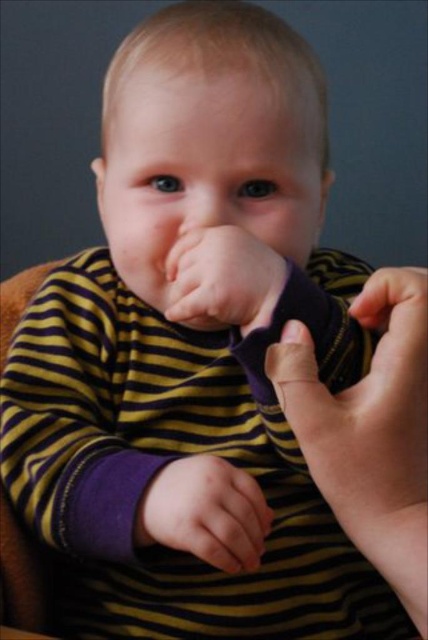
You are a babysitter looking after a baby in a striped shirt. You notice the purple fabric at lower right and the purple soft fabric hand at center in the image. Which object is closer to you?

The purple fabric at lower right is closer to you because it is in front of the purple soft fabric hand at center.

What is the object located at the coordinates point (205,513) in the image?

The object located at point (205,513) is the purple soft fabric hand at center.